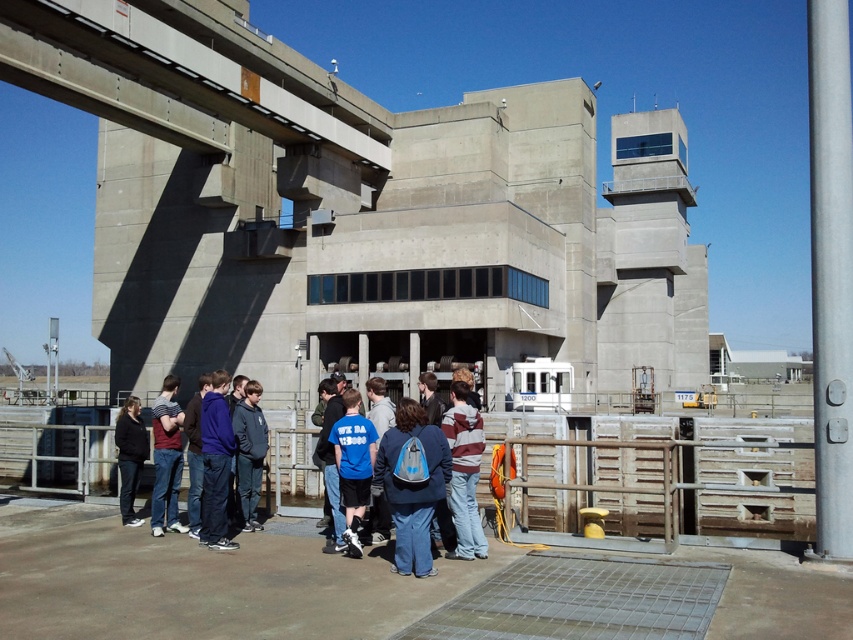
Question: Is the position of dark blue jeans at lower left more distant than that of blue fabric jacket at center?

Choices:
 (A) no
 (B) yes

Answer: (B)

Question: Estimate the real-world distances between objects in this image. Which object is closer to the dark blue jeans at lower left?

Choices:
 (A) blue fabric backpack at center
 (B) blue fabric jacket at center
 (C) striped sweater at center
 (D) white matte ferry at center

Answer: (B)

Question: Does striped sweater at center come in front of dark blue jacket at center?

Choices:
 (A) yes
 (B) no

Answer: (A)

Question: Among these objects, which one is farthest from the camera?

Choices:
 (A) blue denim jeans at center
 (B) dark blue jacket at center
 (C) blue fabric shirt at center
 (D) striped sweater at center

Answer: (A)

Question: Estimate the real-world distances between objects in this image. Which object is closer to the dark blue jacket at center?

Choices:
 (A) striped sweater at center
 (B) dark gray hoodie at center
 (C) blue denim jeans at center
 (D) dark blue hoodie at center

Answer: (D)

Question: Is blue fabric shirt at center positioned in front of white matte ferry at center?

Choices:
 (A) no
 (B) yes

Answer: (B)